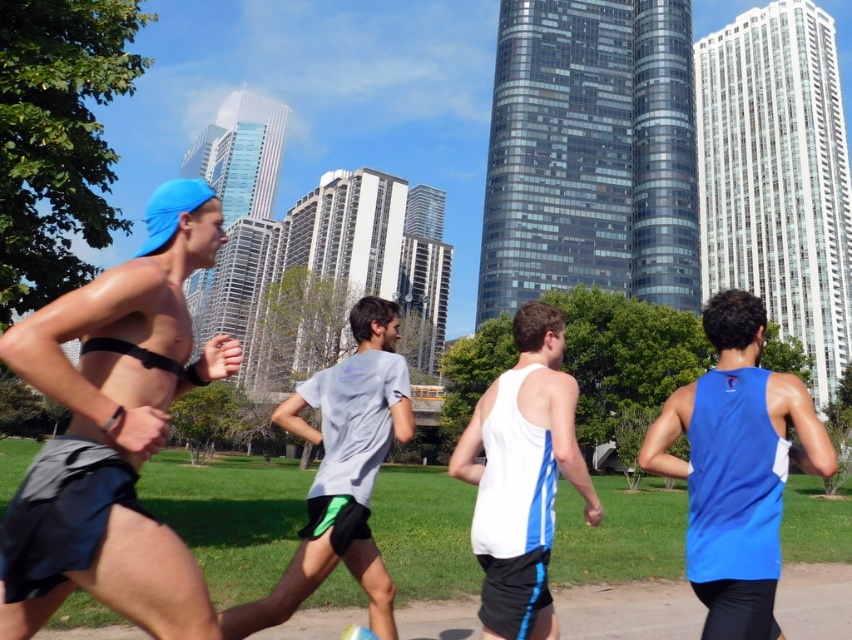
Who is positioned more to the left, matte blue cap at left or gray fabric shirt at center?

matte blue cap at left is more to the left.

Between matte blue cap at left and gray fabric shirt at center, which one appears on the right side from the viewer's perspective?

From the viewer's perspective, gray fabric shirt at center appears more on the right side.

Where is `matte blue cap at left`? The width and height of the screenshot is (852, 640). matte blue cap at left is located at coordinates (114, 432).

You are a GUI agent. You are given a task and a screenshot of the screen. Output one action in this format:
    pyautogui.click(x=<x>, y=<y>)
    Task: Click on the matte blue cap at left
    
    Given the screenshot: What is the action you would take?
    coord(114,432)

Is white matte tank top at center above gray fabric shirt at center?

Indeed, white matte tank top at center is positioned over gray fabric shirt at center.

Can you confirm if white matte tank top at center is positioned to the right of gray fabric shirt at center?

Yes, white matte tank top at center is to the right of gray fabric shirt at center.

You are a GUI agent. You are given a task and a screenshot of the screen. Output one action in this format:
    pyautogui.click(x=<x>, y=<y>)
    Task: Click on the white matte tank top at center
    This screenshot has height=640, width=852.
    Given the screenshot: What is the action you would take?
    pyautogui.click(x=522, y=476)

Locate an element on the screen. Image resolution: width=852 pixels, height=640 pixels. white matte tank top at center is located at coordinates (522, 476).

Between matte blue cap at left and blue fabric tank top at right, which one has less height?

Standing shorter between the two is matte blue cap at left.

Between point (111, 348) and point (810, 456), which one is positioned in front?

Point (111, 348) is in front.

Locate an element on the screen. The height and width of the screenshot is (640, 852). matte blue cap at left is located at coordinates (114, 432).